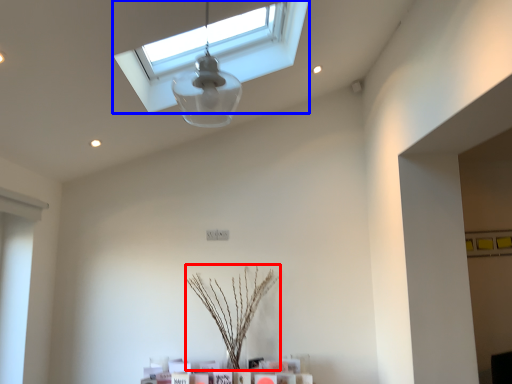
Question: Which object is further to the camera taking this photo, plant (highlighted by a red box) or window (highlighted by a blue box)?

Choices:
 (A) plant
 (B) window

Answer: (A)